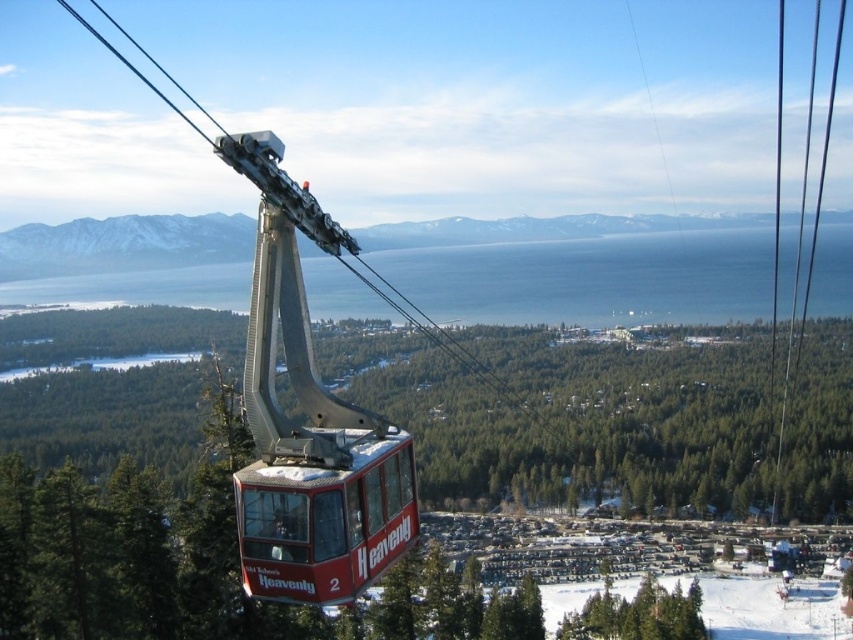
Question: Which point is farther to the camera?

Choices:
 (A) white snow at lower center
 (B) red glossy cable car at center

Answer: (A)

Question: From the image, what is the correct spatial relationship of red glossy cable car at center in relation to white snow at lower center?

Choices:
 (A) below
 (B) above

Answer: (B)

Question: Does red glossy cable car at center have a larger size compared to white snow at lower center?

Choices:
 (A) no
 (B) yes

Answer: (A)

Question: Observing the image, what is the correct spatial positioning of red glossy cable car at center in reference to white snow at lower center?

Choices:
 (A) below
 (B) above

Answer: (B)

Question: Among these points, which one is nearest to the camera?

Choices:
 (A) (250, 561)
 (B) (786, 634)

Answer: (A)